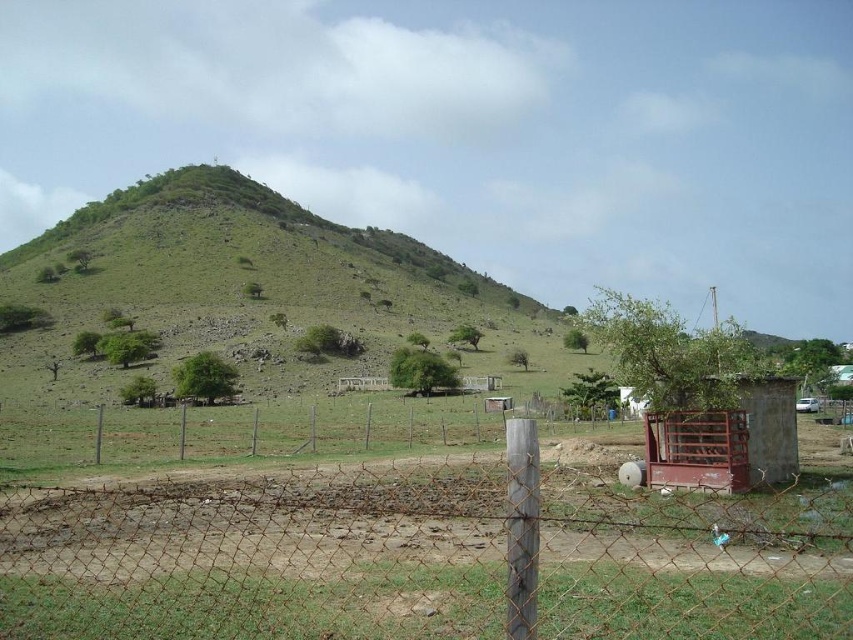
Question: Is rusty wire mesh fence at center thinner than green grassy hillside at upper center?

Choices:
 (A) no
 (B) yes

Answer: (B)

Question: Can you confirm if rusty wire mesh fence at center is positioned below green grassy hillside at upper center?

Choices:
 (A) no
 (B) yes

Answer: (B)

Question: Considering the relative positions of rusty wire mesh fence at center and green grassy hillside at upper center in the image provided, where is rusty wire mesh fence at center located with respect to green grassy hillside at upper center?

Choices:
 (A) left
 (B) right

Answer: (A)

Question: Among these points, which one is nearest to the camera?

Choices:
 (A) (231, 186)
 (B) (619, 582)

Answer: (B)

Question: Which object appears farthest from the camera in this image?

Choices:
 (A) green grassy hillside at upper center
 (B) rusty wire mesh fence at center

Answer: (A)